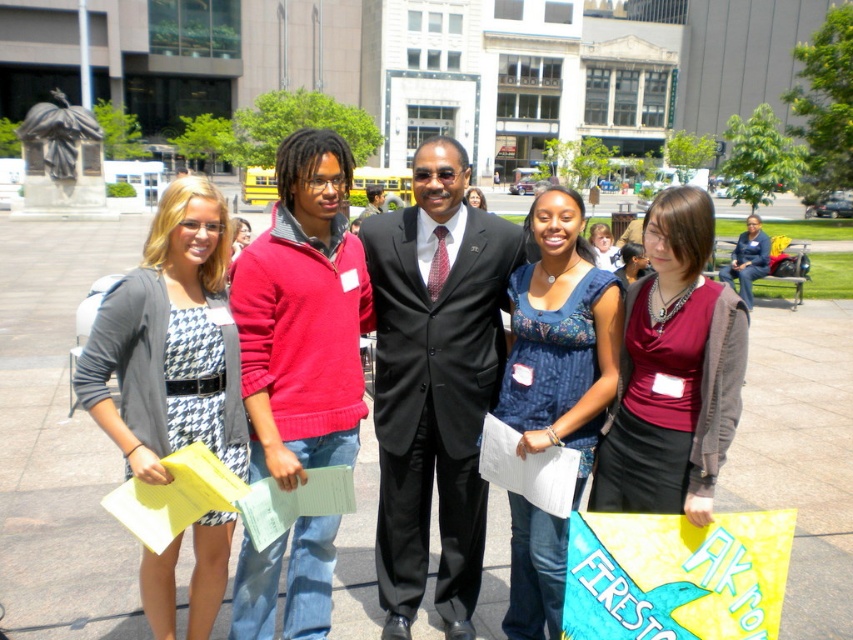
Between houndstooth dress at center and dark suit at center, which one appears on the left side from the viewer's perspective?

houndstooth dress at center is more to the left.

Between houndstooth dress at center and dark suit at center, which one appears on the right side from the viewer's perspective?

Positioned to the right is dark suit at center.

Which is behind, point (241, 220) or point (369, 211)?

The point (369, 211) is more distant.

Image resolution: width=853 pixels, height=640 pixels. Identify the location of houndstooth dress at center. (x=239, y=236).

Which of these two, dark suit at center or matte black dress at center, stands taller?

With more height is dark suit at center.

The image size is (853, 640). Describe the element at coordinates (372, 200) in the screenshot. I see `dark suit at center` at that location.

Locate an element on the screen. dark suit at center is located at coordinates (372, 200).

Between maroon jersey at center and dark gray suit at center, which one has less height?

maroon jersey at center

Is maroon jersey at center behind dark gray suit at center?

No, it is in front of dark gray suit at center.

Measure the distance between maroon jersey at center and camera.

maroon jersey at center and camera are 2.62 meters apart.

Locate an element on the screen. maroon jersey at center is located at coordinates (672, 371).